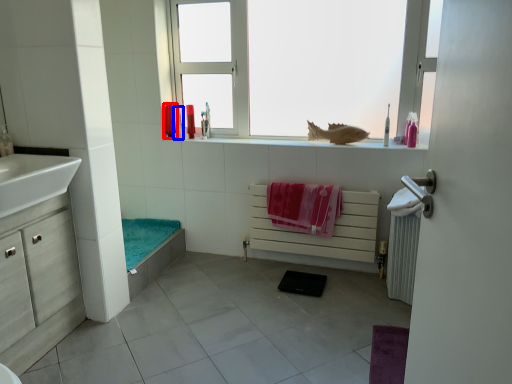
Question: Among these objects, which one is nearest to the camera, toiletry (highlighted by a red box) or toiletry (highlighted by a blue box)?

Choices:
 (A) toiletry
 (B) toiletry

Answer: (B)